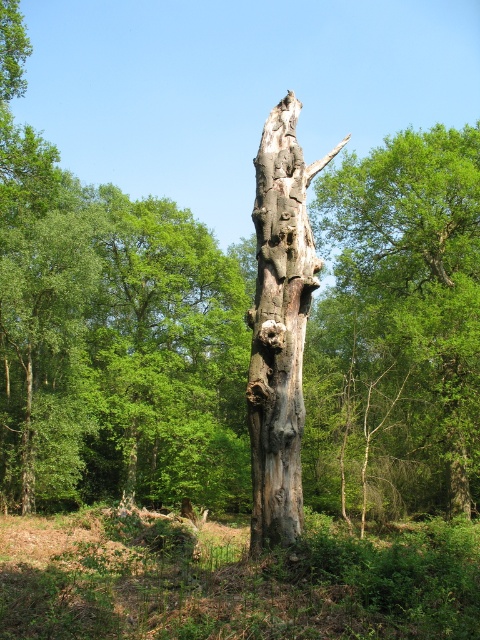
Can you confirm if gray rough bark tree at center is wider than grayish-brown bark tree trunk at center?

No, gray rough bark tree at center is not wider than grayish-brown bark tree trunk at center.

Describe the element at coordinates (397, 330) in the screenshot. I see `gray rough bark tree at center` at that location.

Which is in front, point (394, 330) or point (290, 241)?

Positioned in front is point (290, 241).

Find the location of a particular element. The height and width of the screenshot is (640, 480). gray rough bark tree at center is located at coordinates (397, 330).